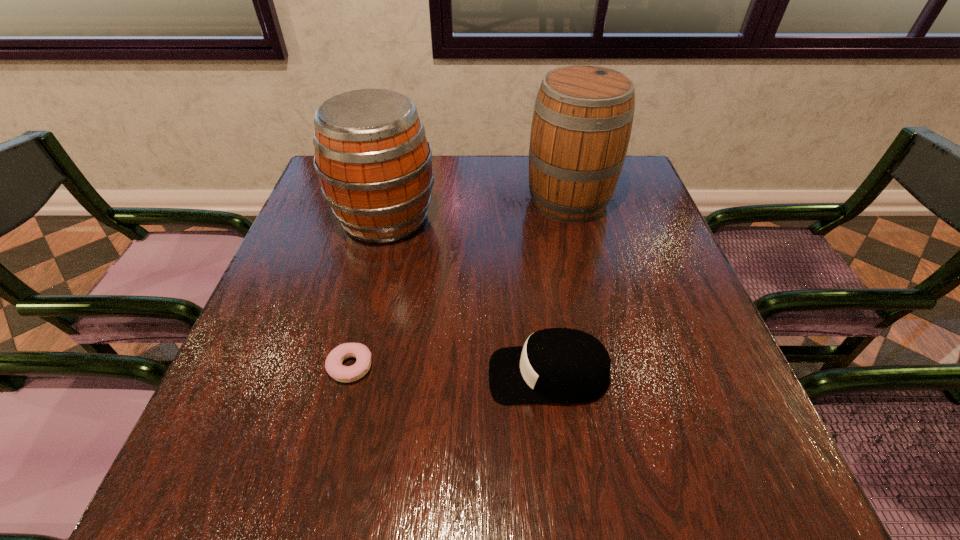
Locate an element on the screen. the right cider is located at coordinates (582, 121).

The height and width of the screenshot is (540, 960). I want to click on the left cider, so click(373, 160).

The width and height of the screenshot is (960, 540). I want to click on cap, so (556, 365).

I want to click on the shortest object, so click(x=333, y=364).

Identify the location of blank space located 0.090m on the left of the right cider. The height and width of the screenshot is (540, 960). tap(492, 200).

You are a GUI agent. You are given a task and a screenshot of the screen. Output one action in this format:
    pyautogui.click(x=<x>, y=<y>)
    Task: Click on the vacant space located on the front of the left cider
    This screenshot has width=960, height=540.
    Given the screenshot: What is the action you would take?
    pyautogui.click(x=365, y=304)

Locate an element on the screen. The image size is (960, 540). vacant area situated on the front-facing side of the second shortest object is located at coordinates (302, 375).

Where is `vacant space situated 0.230m on the front-facing side of the second shortest object`? vacant space situated 0.230m on the front-facing side of the second shortest object is located at coordinates (363, 375).

At what (x,y) coordinates should I click in order to perform the action: click on vacant area situated on the front-facing side of the second shortest object. Please return your answer as a coordinate pair (x, y). Image resolution: width=960 pixels, height=540 pixels. Looking at the image, I should click on (357, 375).

This screenshot has height=540, width=960. In order to click on free region located 0.060m on the back of the shortest object in this screenshot , I will do `click(361, 325)`.